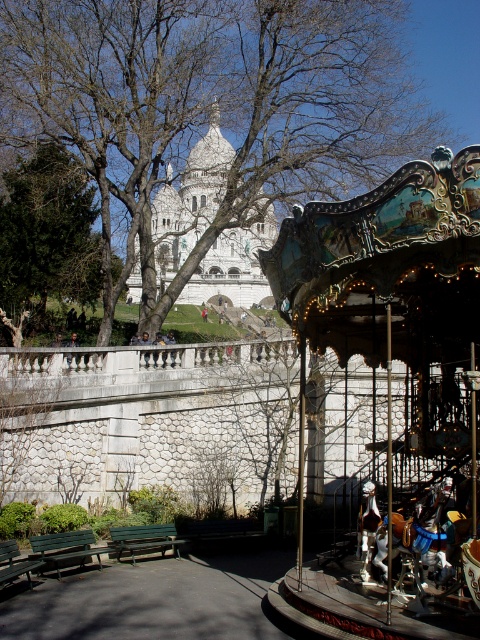
Question: From the image, what is the correct spatial relationship of shiny teal carousel at right in relation to green wood bench at lower left?

Choices:
 (A) above
 (B) below

Answer: (A)

Question: Does brown leafless tree at center appear under green leafy tree at upper left?

Choices:
 (A) yes
 (B) no

Answer: (B)

Question: Considering the real-world distances, which object is farthest from the green leafy tree at upper left?

Choices:
 (A) green painted wood bench at lower left
 (B) green wooden bench at lower left

Answer: (B)

Question: Is shiny teal carousel at right in front of green wood bench at lower left?

Choices:
 (A) yes
 (B) no

Answer: (A)

Question: Which of the following is the closest to the observer?

Choices:
 (A) (442, 186)
 (B) (12, 563)
 (C) (12, 243)

Answer: (A)

Question: Among these objects, which one is farthest from the camera?

Choices:
 (A) brown leafless tree at center
 (B) shiny teal carousel at right

Answer: (A)